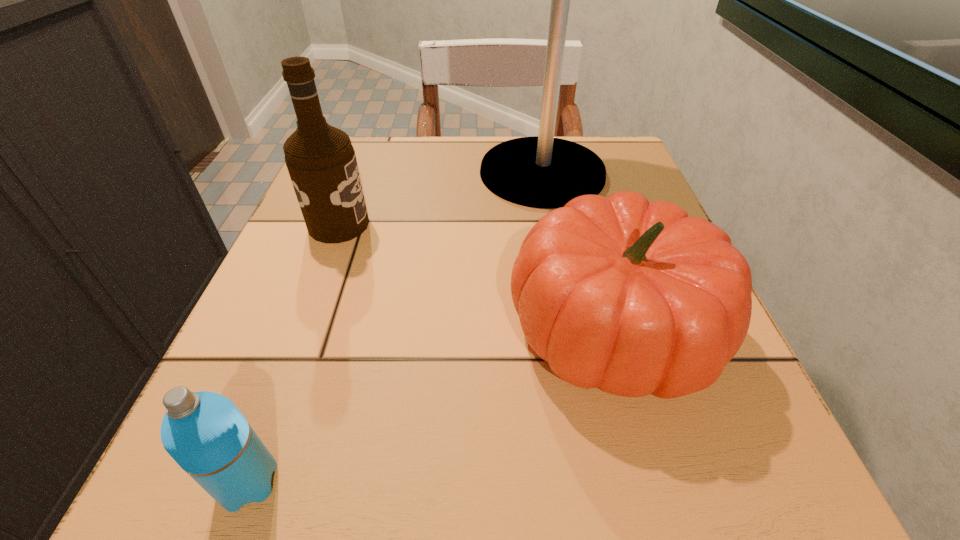
Choose which object is the third nearest neighbor to the pumpkin. Please provide its 2D coordinates. Your answer should be formatted as a tuple, i.e. [(x, y)], where the tuple contains the x and y coordinates of a point satisfying the conditions above.

[(204, 432)]

This screenshot has width=960, height=540. I want to click on object that can be found as the closest to the third shortest object, so click(544, 172).

Identify the location of blank space that satisfies the following two spatial constraints: 1. on the back side of the pumpkin; 2. on the right side of the nearest object. (304, 330).

In order to click on vacant area that satisfies the following two spatial constraints: 1. on the label of the third shortest object; 2. on the back side of the thermos bottle in this screenshot , I will do `click(242, 482)`.

Find the location of a particular element. vacant space that satisfies the following two spatial constraints: 1. on the front side of the table lamp; 2. on the label of the third shortest object is located at coordinates (552, 225).

You are a GUI agent. You are given a task and a screenshot of the screen. Output one action in this format:
    pyautogui.click(x=<x>, y=<y>)
    Task: Click on the vacant space that satisfies the following two spatial constraints: 1. on the label of the pumpkin; 2. on the left side of the third shortest object
    
    Given the screenshot: What is the action you would take?
    pyautogui.click(x=300, y=330)

Where is `vacant space that satisfies the following two spatial constraints: 1. on the label of the thermos bottle; 2. on the right side of the second tallest object`? Image resolution: width=960 pixels, height=540 pixels. vacant space that satisfies the following two spatial constraints: 1. on the label of the thermos bottle; 2. on the right side of the second tallest object is located at coordinates (242, 482).

You are a GUI agent. You are given a task and a screenshot of the screen. Output one action in this format:
    pyautogui.click(x=<x>, y=<y>)
    Task: Click on the free spot that satisfies the following two spatial constraints: 1. on the label of the alcohol; 2. on the right side of the third farthest object
    The image size is (960, 540).
    Given the screenshot: What is the action you would take?
    pyautogui.click(x=300, y=330)

Where is `free space that satisfies the following two spatial constraints: 1. on the label of the nearest object; 2. on the right side of the alcohol`? This screenshot has width=960, height=540. free space that satisfies the following two spatial constraints: 1. on the label of the nearest object; 2. on the right side of the alcohol is located at coordinates (242, 482).